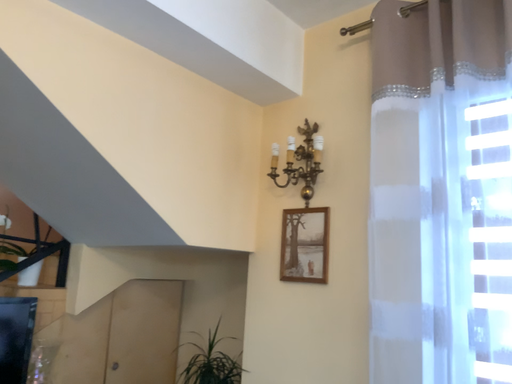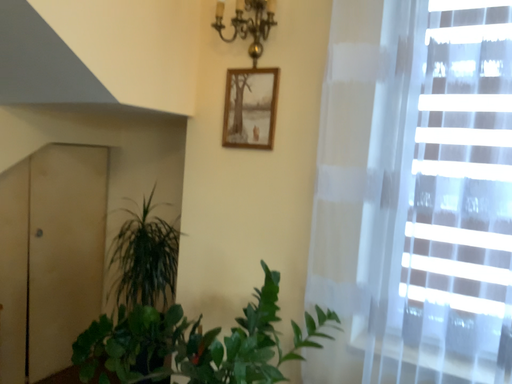
Question: Which way did the camera rotate in the video?

Choices:
 (A) rotated right
 (B) rotated left

Answer: (A)